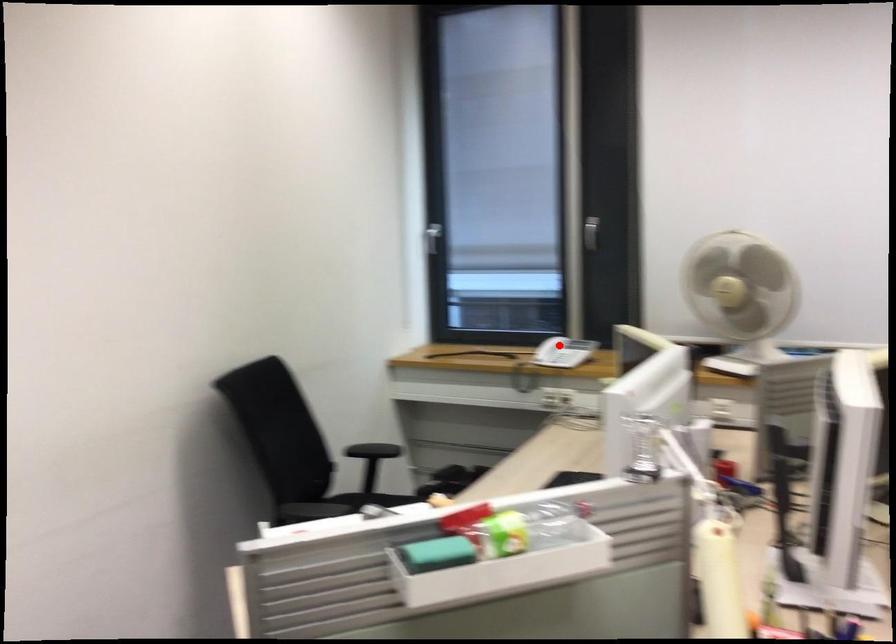
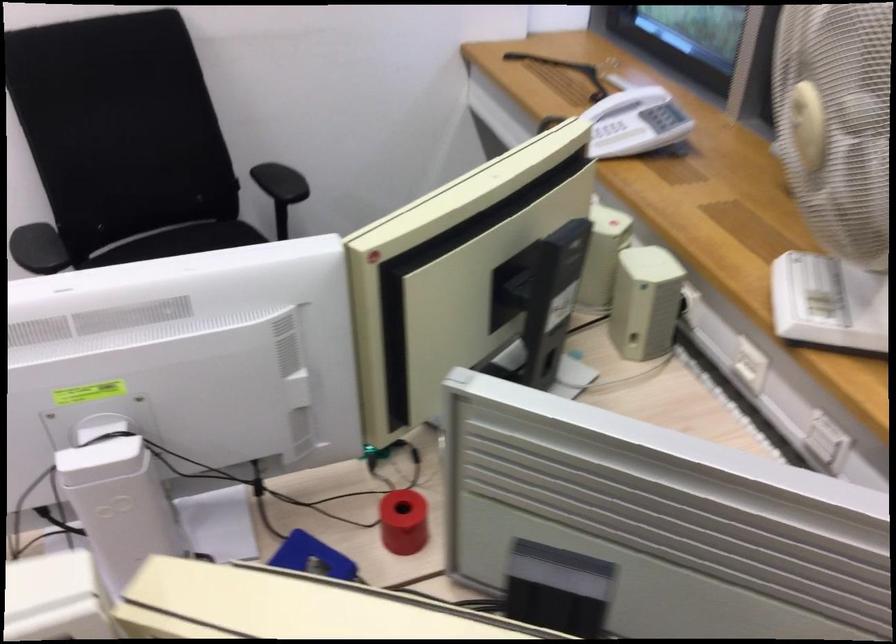
Question: I am providing you with two images of the same scene from different viewpoints. In image1, a red point is highlighted. Considering the same 3D point in image2, which of the following is correct?

Choices:
 (A) It is closer
 (B) It is farther

Answer: (A)